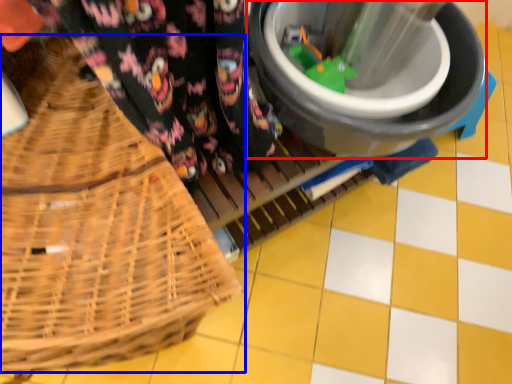
Question: Which object appears farthest to the camera in this image, appliance (highlighted by a red box) or picnic basket (highlighted by a blue box)?

Choices:
 (A) appliance
 (B) picnic basket

Answer: (A)